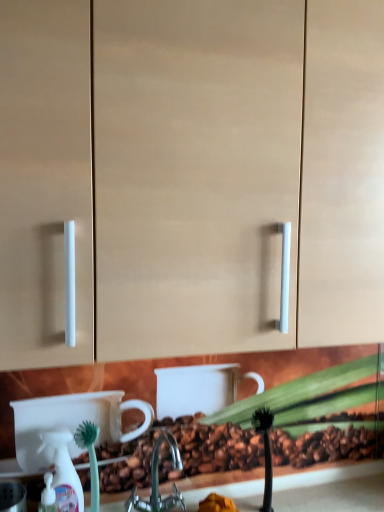
Question: Is metallic silver faucet at center not near matte beige cabinet at center?

Choices:
 (A) no
 (B) yes

Answer: (A)

Question: Can you confirm if metallic silver faucet at center is thinner than matte beige cabinet at center?

Choices:
 (A) no
 (B) yes

Answer: (B)

Question: Is metallic silver faucet at center closer to the viewer compared to matte beige cabinet at center?

Choices:
 (A) yes
 (B) no

Answer: (B)

Question: Is metallic silver faucet at center with matte beige cabinet at center?

Choices:
 (A) no
 (B) yes

Answer: (A)

Question: Is metallic silver faucet at center oriented away from matte beige cabinet at center?

Choices:
 (A) yes
 (B) no

Answer: (B)

Question: Considering the positions of matte beige cabinet at center and green bristle brush at lower left in the image, is matte beige cabinet at center wider or thinner than green bristle brush at lower left?

Choices:
 (A) thin
 (B) wide

Answer: (B)

Question: Is matte beige cabinet at center to the left or to the right of green bristle brush at lower left in the image?

Choices:
 (A) right
 (B) left

Answer: (A)

Question: Is matte beige cabinet at center spatially inside green bristle brush at lower left, or outside of it?

Choices:
 (A) outside
 (B) inside

Answer: (A)

Question: Looking at the image, does matte beige cabinet at center seem bigger or smaller compared to green bristle brush at lower left?

Choices:
 (A) big
 (B) small

Answer: (A)

Question: In terms of height, does white plastic spray bottle at lower left look taller or shorter compared to matte beige cabinet at center?

Choices:
 (A) tall
 (B) short

Answer: (B)

Question: Visually, is white plastic spray bottle at lower left positioned to the left or to the right of matte beige cabinet at center?

Choices:
 (A) left
 (B) right

Answer: (A)

Question: From a real-world perspective, is white plastic spray bottle at lower left positioned above or below matte beige cabinet at center?

Choices:
 (A) below
 (B) above

Answer: (A)

Question: In terms of size, does white plastic spray bottle at lower left appear bigger or smaller than matte beige cabinet at center?

Choices:
 (A) big
 (B) small

Answer: (B)

Question: From the image's perspective, is metallic silver faucet at center located above or below white plastic spray bottle at lower left?

Choices:
 (A) below
 (B) above

Answer: (A)

Question: Considering the positions of metallic silver faucet at center and white plastic spray bottle at lower left in the image, is metallic silver faucet at center wider or thinner than white plastic spray bottle at lower left?

Choices:
 (A) wide
 (B) thin

Answer: (A)